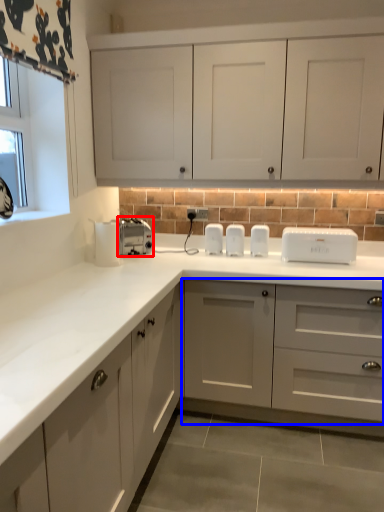
Question: Which object is closer to the camera taking this photo, toaster (highlighted by a red box) or cabinetry (highlighted by a blue box)?

Choices:
 (A) toaster
 (B) cabinetry

Answer: (B)